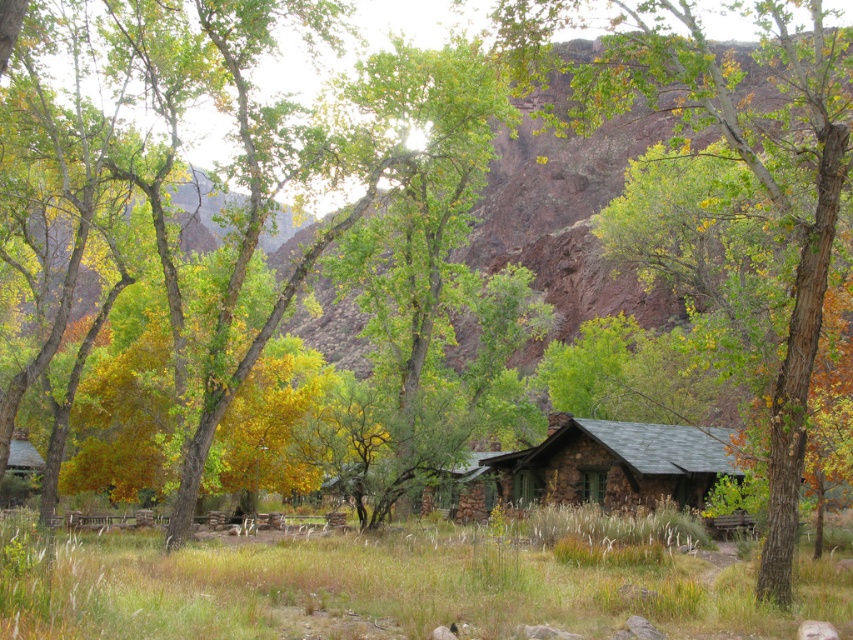
Question: Does green grass at lower center have a larger size compared to rustic stone cabin at center?

Choices:
 (A) yes
 (B) no

Answer: (A)

Question: Does green leafy tree at center have a smaller size compared to rustic stone cabin at center?

Choices:
 (A) no
 (B) yes

Answer: (A)

Question: Estimate the real-world distances between objects in this image. Which object is closer to the green leafy tree at center?

Choices:
 (A) green grass at lower center
 (B) rustic stone cabin at center

Answer: (B)

Question: Among these points, which one is nearest to the camera?

Choices:
 (A) (726, 570)
 (B) (467, 470)
 (C) (775, 32)

Answer: (A)

Question: Does green grass at lower center have a lesser width compared to rustic stone cabin at center?

Choices:
 (A) yes
 (B) no

Answer: (B)

Question: Based on their relative distances, which object is farther from the green grass at lower center?

Choices:
 (A) green leafy tree at center
 (B) rustic stone cabin at center

Answer: (A)